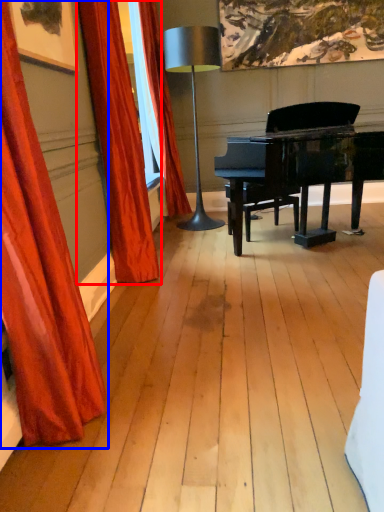
Question: Which of the following is the closest to the observer, curtain (highlighted by a red box) or curtain (highlighted by a blue box)?

Choices:
 (A) curtain
 (B) curtain

Answer: (B)